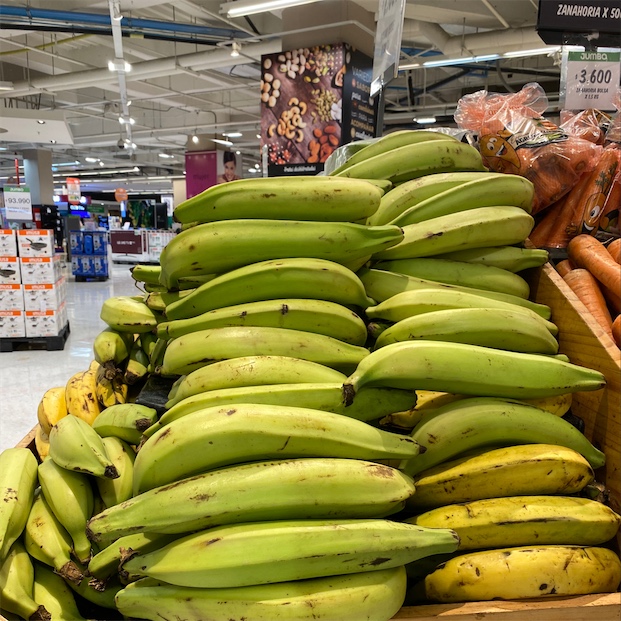
Image resolution: width=621 pixels, height=621 pixels. Identify the location of flat screen television. (128, 237).